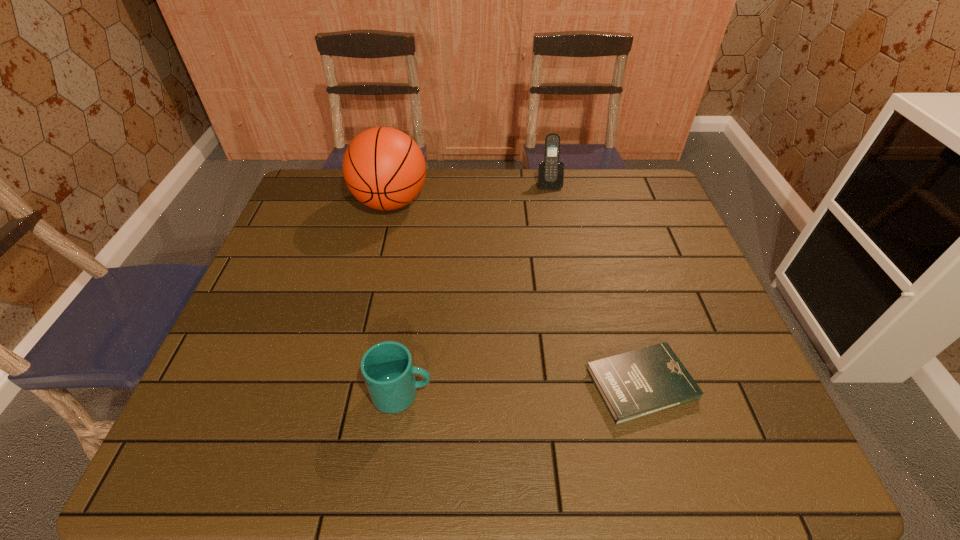
Where is `free spot that satisfies the following two spatial constraints: 1. on the front side of the shortest object; 2. on the right side of the tallest object`? The height and width of the screenshot is (540, 960). free spot that satisfies the following two spatial constraints: 1. on the front side of the shortest object; 2. on the right side of the tallest object is located at coordinates [x=348, y=384].

I want to click on vacant region that satisfies the following two spatial constraints: 1. on the front-facing side of the second tallest object; 2. on the handle side of the second shortest object, so click(x=588, y=394).